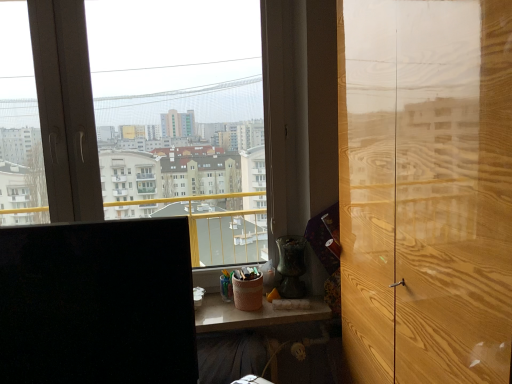
Question: Choose the correct answer: Is wooden table at lower center inside black matte computer monitor at left or outside it?

Choices:
 (A) inside
 (B) outside

Answer: (B)

Question: Considering the positions of wooden table at lower center and black matte computer monitor at left in the image, is wooden table at lower center bigger or smaller than black matte computer monitor at left?

Choices:
 (A) big
 (B) small

Answer: (B)

Question: Which object is the farthest from the wooden table at lower center?

Choices:
 (A) transparent glass window at center
 (B) light brown wood door at right
 (C) black matte computer monitor at left

Answer: (C)

Question: Which is farther from the light brown wood door at right?

Choices:
 (A) wooden table at lower center
 (B) transparent glass window at center
 (C) black matte computer monitor at left

Answer: (B)